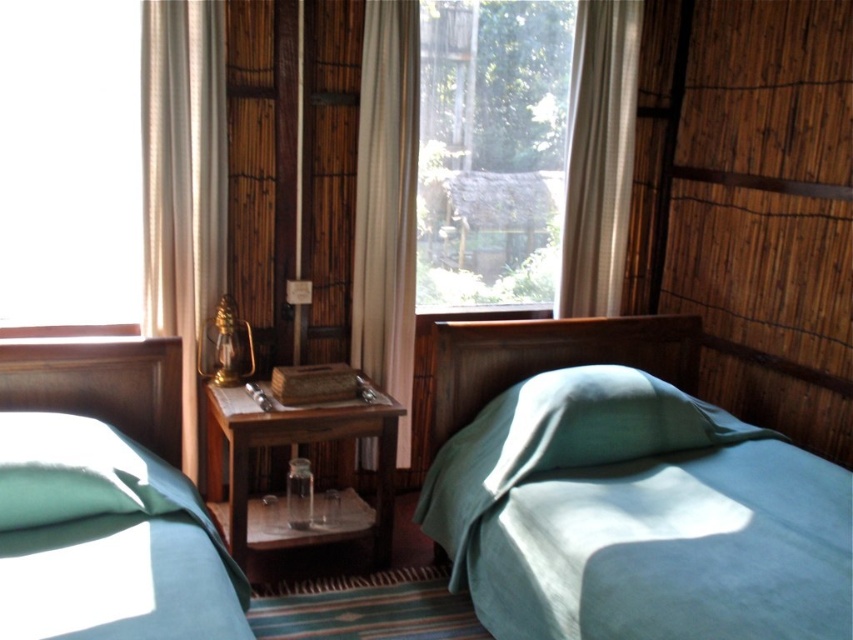
Question: Does beige fabric curtain at upper center appear over matte green pillow at lower left?

Choices:
 (A) yes
 (B) no

Answer: (A)

Question: Is matte green fabric bed at center to the left of transparent glass window at center from the viewer's perspective?

Choices:
 (A) no
 (B) yes

Answer: (A)

Question: Which of these objects is positioned closest to the matte green pillow at lower left?

Choices:
 (A) transparent glass window at upper left
 (B) matte green fabric bed at left
 (C) white sheer curtain at upper center
 (D) white fabric curtain at left

Answer: (B)

Question: Which of the following is the farthest from the observer?

Choices:
 (A) matte green fabric bed at left
 (B) white fabric curtain at left
 (C) transparent glass window at upper left
 (D) transparent glass window at center

Answer: (D)

Question: Considering the relative positions of transparent glass window at center and matte green fabric bed at left in the image provided, where is transparent glass window at center located with respect to matte green fabric bed at left?

Choices:
 (A) right
 (B) left

Answer: (A)

Question: Which point is farther to the camera?

Choices:
 (A) transparent glass window at center
 (B) matte green fabric bed at center
 (C) beige fabric curtain at upper center
 (D) matte green fabric bed at left

Answer: (A)